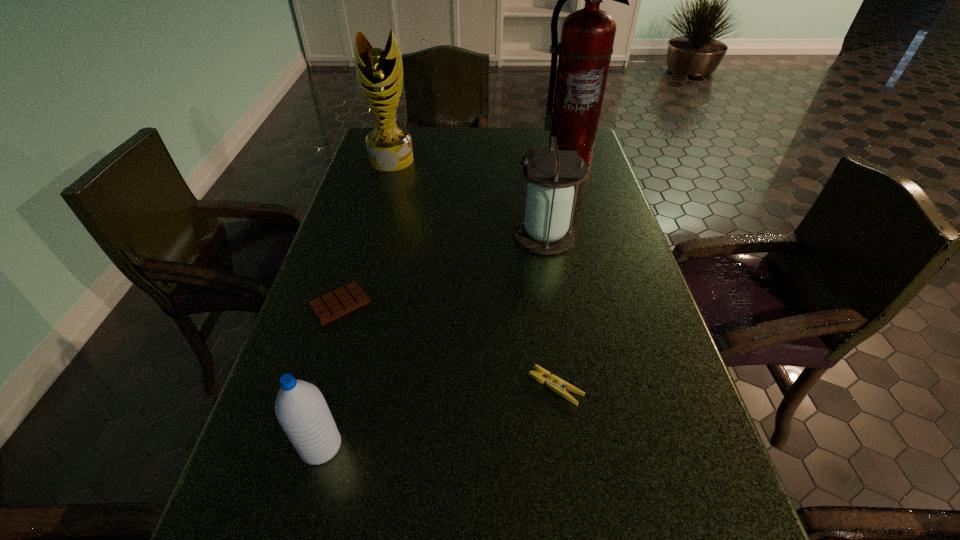
The image size is (960, 540). Identify the location of vacant region between the lantern and the award. (468, 198).

Identify the location of free spot between the tallest object and the fourth farthest object. (454, 231).

I want to click on unoccupied position between the fire extinguisher and the fourth farthest object, so click(x=454, y=231).

Where is `vacant region between the fire extinguisher and the fifth farthest object`? vacant region between the fire extinguisher and the fifth farthest object is located at coordinates tap(562, 272).

At what (x,y) coordinates should I click in order to perform the action: click on vacant space that is in between the award and the fourth nearest object. Please return your answer as a coordinate pair (x, y). Looking at the image, I should click on (468, 198).

You are a GUI agent. You are given a task and a screenshot of the screen. Output one action in this format:
    pyautogui.click(x=<x>, y=<y>)
    Task: Click on the unoccupied position between the second nearest object and the fire extinguisher
    
    Given the screenshot: What is the action you would take?
    pyautogui.click(x=562, y=272)

Identify which object is the fifth nearest to the fourth nearest object. Please provide its 2D coordinates. Your answer should be formatted as a tuple, i.e. [(x, y)], where the tuple contains the x and y coordinates of a point satisfying the conditions above.

[(301, 409)]

The image size is (960, 540). What are the coordinates of `the third closest object relative to the award` in the screenshot? It's located at (343, 300).

You are a GUI agent. You are given a task and a screenshot of the screen. Output one action in this format:
    pyautogui.click(x=<x>, y=<y>)
    Task: Click on the free spot that satisfies the following two spatial constraints: 1. on the front side of the candy bar; 2. on the right side of the water bottle
    Image resolution: width=960 pixels, height=540 pixels.
    Given the screenshot: What is the action you would take?
    pyautogui.click(x=296, y=446)